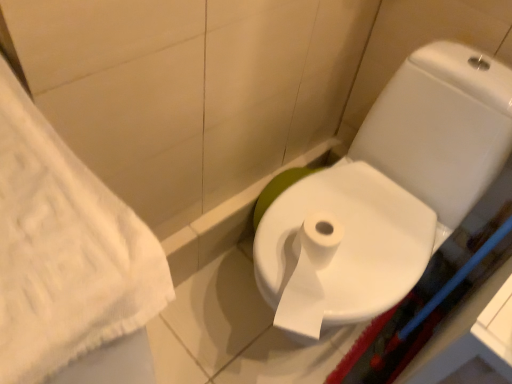
Question: Is white glossy toilet at center inside the boundaries of white textured towel at left, or outside?

Choices:
 (A) inside
 (B) outside

Answer: (B)

Question: From a real-world perspective, is white glossy toilet at center physically located above or below white textured towel at left?

Choices:
 (A) below
 (B) above

Answer: (A)

Question: Estimate the real-world distances between objects in this image. Which object is farther from the white glossy toilet at center?

Choices:
 (A) white textured towel at left
 (B) white paper bidet at center

Answer: (A)

Question: Which of these objects is positioned closest to the white glossy toilet at center?

Choices:
 (A) white paper bidet at center
 (B) white textured towel at left

Answer: (A)